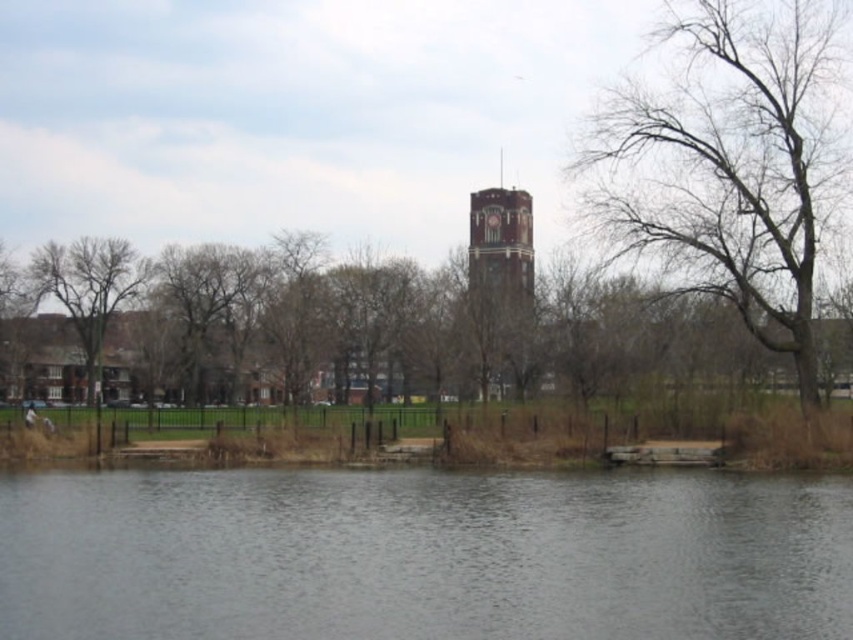
You are standing at the edge of the gray water at lower center and want to walk towards the bare branches at right. Which direction should you move to reach them?

Since the gray water at lower center is in front of the bare branches at right, you should move backward to reach the bare branches at right.

You are standing at the point labeled as point (422,556) in the image. What is the color of the surface you are currently standing on?

The point (422,556) corresponds to gray water at lower center, so the surface is gray water.

You are standing at the edge of the lake and see two points marked in the scene. The first point is at coordinates point (x=636, y=477) and the second is at point (x=757, y=241). Which point is closer to you?

Point (x=636, y=477) is in front of point (x=757, y=241), so it is closer to you.